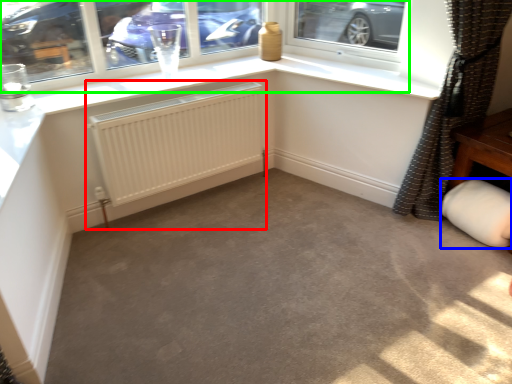
Question: Estimate the real-world distances between objects in this image. Which object is farther from radiator (highlighted by a red box), gray (highlighted by a blue box) or window (highlighted by a green box)?

Choices:
 (A) gray
 (B) window

Answer: (A)